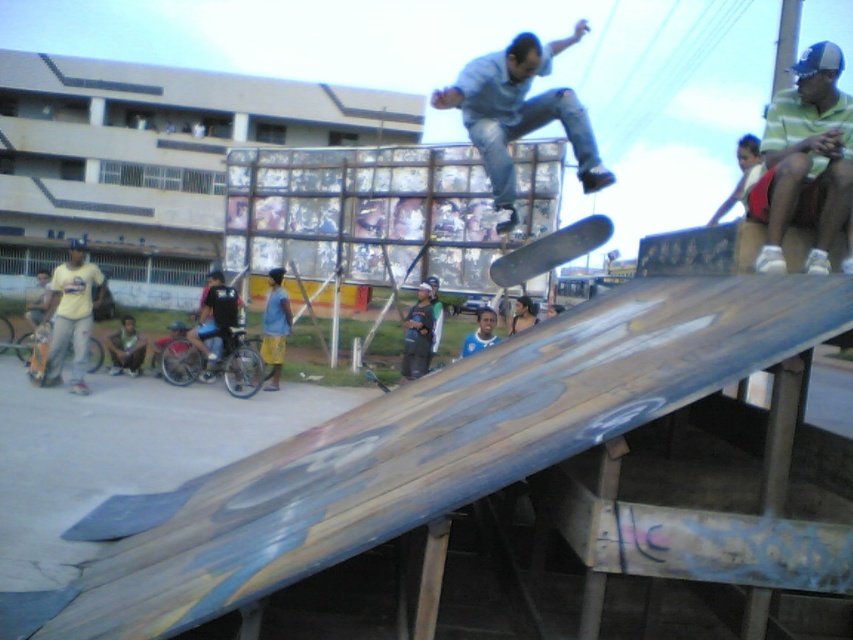
Question: Among these points, which one is nearest to the camera?

Choices:
 (A) (564, 252)
 (B) (810, 172)
 (C) (32, 360)

Answer: (B)

Question: Is denim jeans at center to the left of wooden skateboard at lower left from the viewer's perspective?

Choices:
 (A) yes
 (B) no

Answer: (B)

Question: Which object is the closest to the matte yellow shirt at left?

Choices:
 (A) smooth black skateboard at center
 (B) denim jeans at center
 (C) striped green and white shirt at upper right

Answer: (A)

Question: From the image, what is the correct spatial relationship of striped green and white shirt at upper right in relation to denim jeans at center?

Choices:
 (A) below
 (B) above

Answer: (A)

Question: Does matte yellow shirt at left have a larger size compared to smooth black skateboard at center?

Choices:
 (A) no
 (B) yes

Answer: (B)

Question: Among these objects, which one is farthest from the camera?

Choices:
 (A) wooden skateboard at lower left
 (B) striped green and white shirt at upper right
 (C) matte yellow shirt at left
 (D) denim jeans at center

Answer: (A)